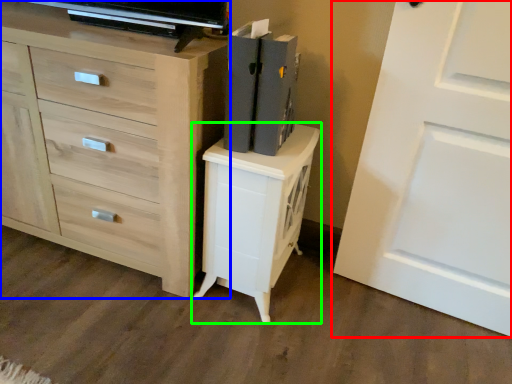
Question: Estimate the real-world distances between objects in this image. Which object is closer to door (highlighted by a red box), chest of drawers (highlighted by a blue box) or nightstand (highlighted by a green box)?

Choices:
 (A) chest of drawers
 (B) nightstand

Answer: (B)